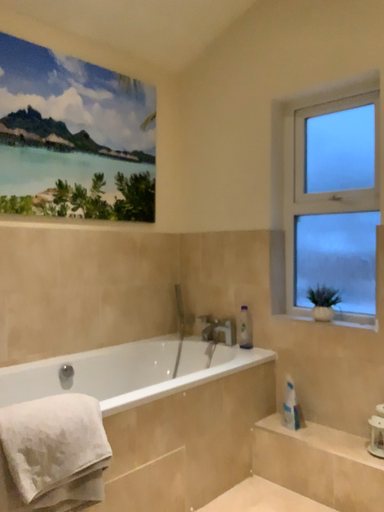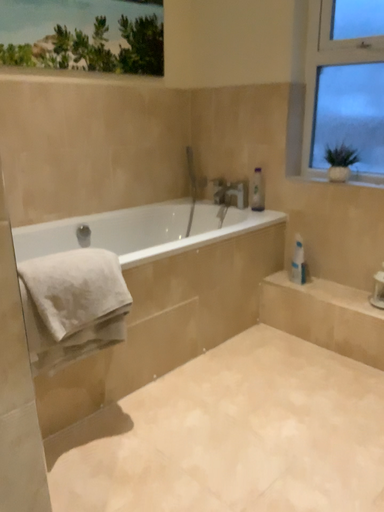
Question: Which way did the camera rotate in the video?

Choices:
 (A) rotated downward
 (B) rotated upward

Answer: (A)